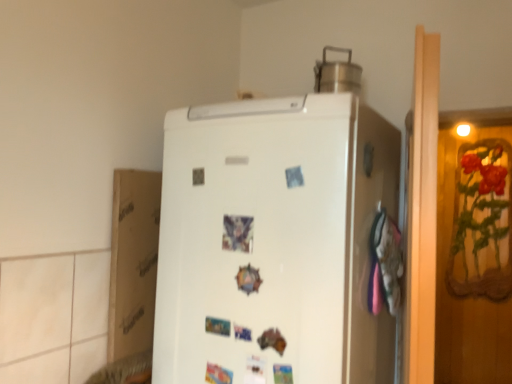
What is the approximate height of brushed metal pot at upper center?

brushed metal pot at upper center is 9.48 inches in height.

What do you see at coordinates (133, 261) in the screenshot? The image size is (512, 384). I see `white cardboard at left` at bounding box center [133, 261].

What are the coordinates of `brushed metal pot at upper center` in the screenshot? It's located at (337, 74).

Considering the points (230, 325) and (318, 68), which point is in front, point (230, 325) or point (318, 68)?

The point (230, 325) is in front.

Which of these two, white matte refrigerator at center or brushed metal pot at upper center, is smaller?

brushed metal pot at upper center.

Is white matte refrigerator at center at the right side of brushed metal pot at upper center?

In fact, white matte refrigerator at center is to the left of brushed metal pot at upper center.

Which object is wider, white matte refrigerator at center or white cardboard at left?

white matte refrigerator at center.

Is white matte refrigerator at center positioned beyond the bounds of white cardboard at left?

Yes, white matte refrigerator at center is located beyond the bounds of white cardboard at left.

Could you tell me if white matte refrigerator at center is facing white cardboard at left?

No, white matte refrigerator at center is not oriented towards white cardboard at left.

In the image, is white matte refrigerator at center on the left side or the right side of white cardboard at left?

From the image, it's evident that white matte refrigerator at center is to the right of white cardboard at left.

This screenshot has width=512, height=384. I want to click on cardboard box in front of the brushed metal pot at upper center, so click(x=133, y=261).

Would you say brushed metal pot at upper center is inside or outside white cardboard at left?

brushed metal pot at upper center exists outside the volume of white cardboard at left.

From the image's perspective, is brushed metal pot at upper center over white cardboard at left?

Yes, from the image's perspective, brushed metal pot at upper center is above white cardboard at left.

From a real-world perspective, relative to white cardboard at left, is brushed metal pot at upper center vertically above or below?

From a real-world perspective, brushed metal pot at upper center is physically above white cardboard at left.

From the image's perspective, which one is positioned lower, white cardboard at left or white matte refrigerator at center?

white cardboard at left appears lower in the image.

Between white cardboard at left and white matte refrigerator at center, which one has larger width?

With larger width is white matte refrigerator at center.

In the scene shown: How distant is white cardboard at left from white matte refrigerator at center?

They are 14.35 inches apart.

Which is closer, (110, 355) or (168, 171)?

The point (168, 171) is in front.

Which is behind, point (324, 88) or point (258, 239)?

The point (324, 88) is more distant.

Is brushed metal pot at upper center taller than white matte refrigerator at center?

No.

Where is `appliance on the right side of white matte refrigerator at center`? appliance on the right side of white matte refrigerator at center is located at coordinates (337, 74).

Which object is positioned more to the left, white cardboard at left or brushed metal pot at upper center?

white cardboard at left.

Is white cardboard at left not close to brushed metal pot at upper center?

No, white cardboard at left is not far from brushed metal pot at upper center.

From the image's perspective, is white cardboard at left above brushed metal pot at upper center?

Incorrect, from the image's perspective, white cardboard at left is lower than brushed metal pot at upper center.

Identify the location of appliance that is on the right side of white matte refrigerator at center. (337, 74).

This screenshot has width=512, height=384. Identify the location of refrigerator lying in front of the white cardboard at left. (273, 242).

When comparing their distances from brushed metal pot at upper center, does white matte refrigerator at center or white cardboard at left seem closer?

white matte refrigerator at center is positioned closer to the anchor brushed metal pot at upper center.

From the image, which object appears to be farther from white matte refrigerator at center, white cardboard at left or brushed metal pot at upper center?

Among the two, brushed metal pot at upper center is located further to white matte refrigerator at center.

From the picture: Considering their positions, is white cardboard at left positioned further to brushed metal pot at upper center than white matte refrigerator at center?

Among the two, white cardboard at left is located further to brushed metal pot at upper center.

When comparing their distances from white matte refrigerator at center, does brushed metal pot at upper center or white cardboard at left seem further?

Based on the image, brushed metal pot at upper center appears to be further to white matte refrigerator at center.

Estimate the real-world distances between objects in this image. Which object is closer to white cardboard at left, white matte refrigerator at center or brushed metal pot at upper center?

white matte refrigerator at center lies closer to white cardboard at left than the other object.

Which object lies further to the anchor point white cardboard at left, brushed metal pot at upper center or white matte refrigerator at center?

The object further to white cardboard at left is brushed metal pot at upper center.

Find the location of a particular element. refrigerator between brushed metal pot at upper center and white cardboard at left in the up-down direction is located at coordinates (273, 242).